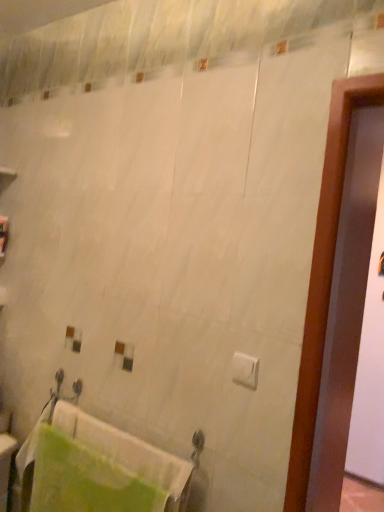
Question: Would you say green fabric towel at lower left is to the left or to the right of white matte toilet paper at center in the picture?

Choices:
 (A) left
 (B) right

Answer: (A)

Question: Based on their sizes in the image, would you say green fabric towel at lower left is bigger or smaller than white matte toilet paper at center?

Choices:
 (A) big
 (B) small

Answer: (A)

Question: Is green fabric towel at lower left taller or shorter than white matte toilet paper at center?

Choices:
 (A) short
 (B) tall

Answer: (B)

Question: Is point (241, 368) positioned closer to the camera than point (112, 429)?

Choices:
 (A) closer
 (B) farther

Answer: (A)

Question: Considering the positions of white matte toilet paper at center and green fabric towel at lower left in the image, is white matte toilet paper at center taller or shorter than green fabric towel at lower left?

Choices:
 (A) short
 (B) tall

Answer: (A)

Question: From a real-world perspective, is white matte toilet paper at center above or below green fabric towel at lower left?

Choices:
 (A) above
 (B) below

Answer: (A)

Question: From the image's perspective, is white matte toilet paper at center above or below green fabric towel at lower left?

Choices:
 (A) above
 (B) below

Answer: (A)